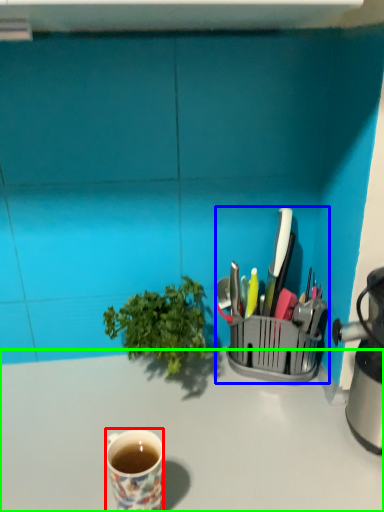
Question: Which object is the farthest from coffee cup (highlighted by a red box)? Choose among these: appliance (highlighted by a blue box) or desk (highlighted by a green box).

Choices:
 (A) appliance
 (B) desk

Answer: (A)